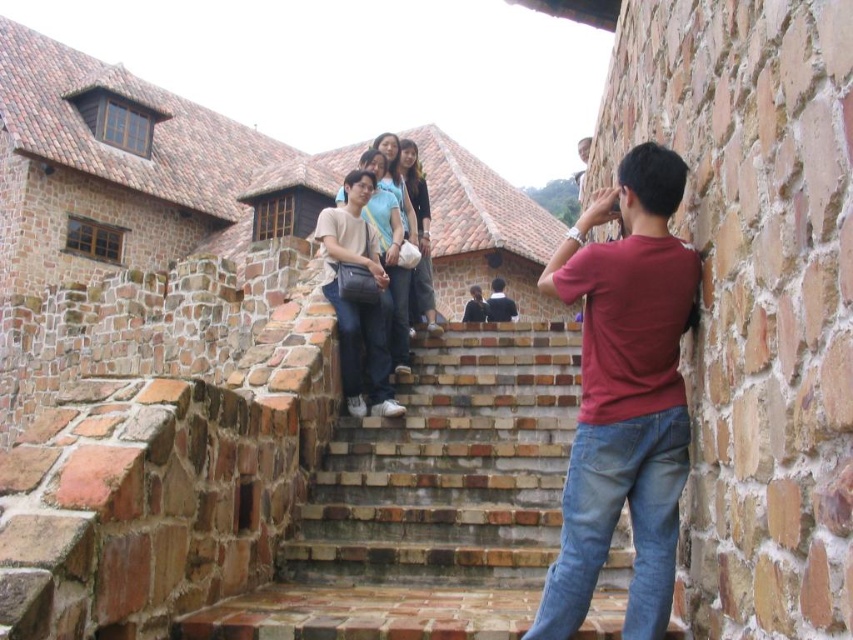
Question: Can you confirm if matte red shirt at right is positioned to the left of matte beige shirt at center?

Choices:
 (A) no
 (B) yes

Answer: (A)

Question: Does matte red shirt at right have a lesser width compared to matte beige shirt at center?

Choices:
 (A) no
 (B) yes

Answer: (A)

Question: Which point is closer to the camera?

Choices:
 (A) dark blue shirt at center
 (B) matte black jacket at center
 (C) matte beige shirt at center
 (D) matte red shirt at right

Answer: (D)

Question: Based on their relative distances, which object is nearer to the matte black jacket at center?

Choices:
 (A) matte beige shirt at center
 (B) matte red shirt at right

Answer: (A)

Question: Is matte red shirt at right below matte beige shirt at center?

Choices:
 (A) yes
 (B) no

Answer: (A)

Question: Which object appears closest to the camera in this image?

Choices:
 (A) dark blue shirt at center
 (B) matte beige shirt at center
 (C) matte red shirt at right
 (D) matte black jacket at center

Answer: (C)